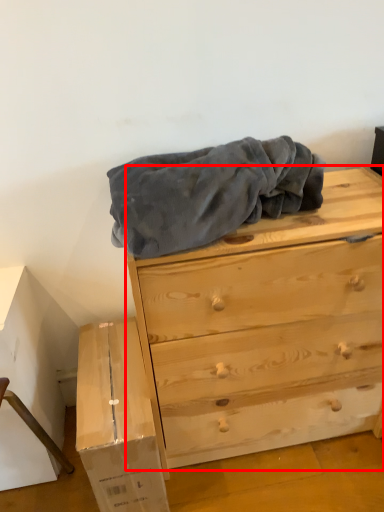
Question: From the image's perspective, what is the correct spatial positioning of chest of drawers (annotated by the red box) in reference to cardboard box?

Choices:
 (A) above
 (B) below

Answer: (A)